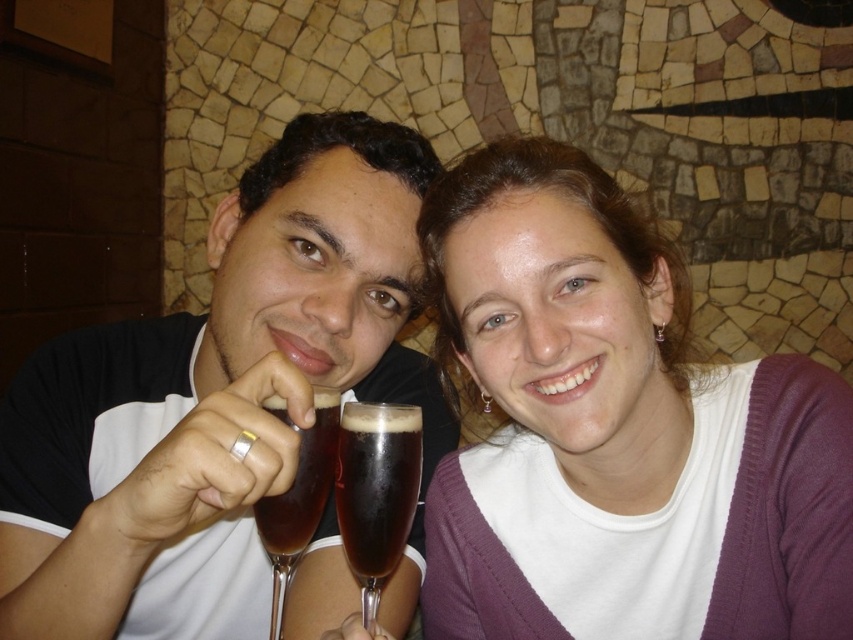
You are a photographer trying to capture the perfect shot of the matte black shirt at left and the dark brown glass at center. You need to ensure that the width of the objects in the frame matches exactly. Which object should you adjust to make them the same width?

The matte black shirt at left is wider than the dark brown glass at center. To make them the same width, you should zoom in slightly on the matte black shirt at left or move closer to it, reducing its apparent width in the frame, while keeping the dark brown glass at center as is.

You are a photographer trying to capture a clear shot of the dark brown glass at center. However, the matte black shirt at left is blocking your view. Can you move the shirt to get an unobstructed view of the glass?

The matte black shirt at left is in front of the dark brown glass at center, so moving the shirt would allow you to see the glass without obstruction.

You are standing in front of a photo of two people. The photo has a textured wall in the background. There is a white knitwear at upper right located at point (616, 432). Can you tell me where the white knitwear at upper right is in relation to the two people?

The white knitwear at upper right is located at point (616, 432), which is in the upper right area of the photo, above and to the right of the two people who are seated in the lower part of the image.